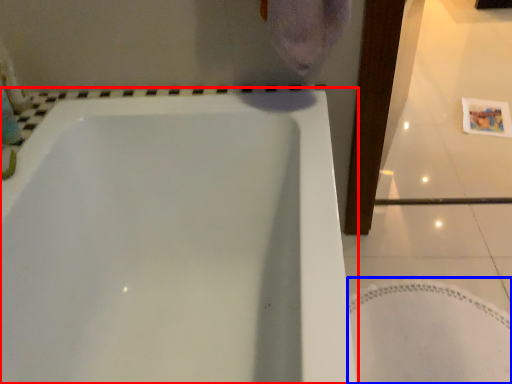
Question: Which object is closer to the camera taking this photo, bathtub (highlighted by a red box) or bath mat (highlighted by a blue box)?

Choices:
 (A) bathtub
 (B) bath mat

Answer: (A)